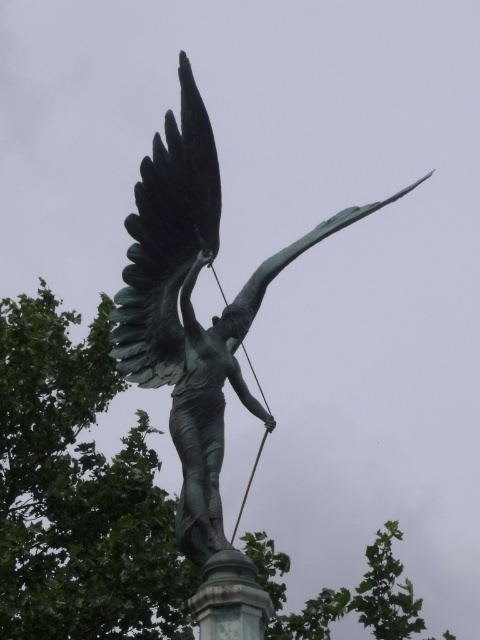
You are an art conservator assessing the placement of the bronze statue at center and the green polished stone pillar at center in the image. Which object is positioned further back in the scene?

The green polished stone pillar at center is positioned behind the bronze statue at center, so it is further back in the scene.

Based on the photo, you are a photographer trying to capture the bronze statue at center without any obstructions. Given that the green leafy tree at upper left is in the way, can you position yourself in a way to avoid the tree blocking the statue?

The bronze statue at center is behind the green leafy tree at upper left, so positioning yourself to the side or behind the tree would allow you to capture the statue without obstruction.

Consider the image. You are a photographer planning to capture the bronze statue at center against the backdrop of the green leafy tree at upper left. Based on their sizes, will the tree likely cover more of the camera frame horizontally compared to the statue?

The green leafy tree at upper left might be wider than bronze statue at center, so it could potentially cover more of the camera frame horizontally compared to the statue.